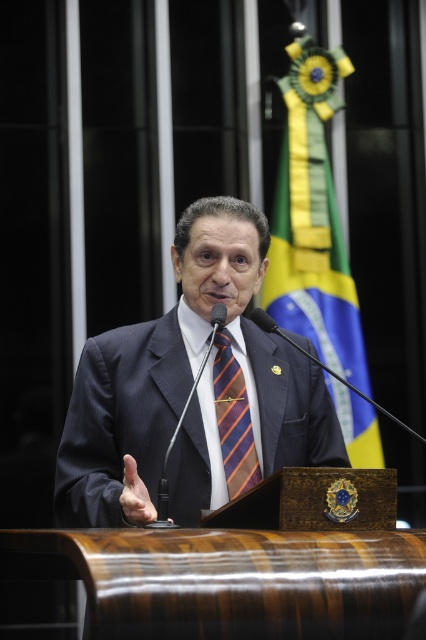
Can you confirm if dark blue suit at center is positioned below yellow-green fabric flag at upper center?

Yes, dark blue suit at center is below yellow-green fabric flag at upper center.

You are a GUI agent. You are given a task and a screenshot of the screen. Output one action in this format:
    pyautogui.click(x=<x>, y=<y>)
    Task: Click on the dark blue suit at center
    The image size is (426, 640).
    Given the screenshot: What is the action you would take?
    pyautogui.click(x=189, y=388)

Image resolution: width=426 pixels, height=640 pixels. In order to click on dark blue suit at center in this screenshot , I will do `click(189, 388)`.

How distant is yellow-green fabric flag at upper center from orange striped tie at center?

A distance of 3.13 meters exists between yellow-green fabric flag at upper center and orange striped tie at center.

Between yellow-green fabric flag at upper center and orange striped tie at center, which one has more height?

With more height is yellow-green fabric flag at upper center.

This screenshot has height=640, width=426. What do you see at coordinates (313, 220) in the screenshot? I see `yellow-green fabric flag at upper center` at bounding box center [313, 220].

Image resolution: width=426 pixels, height=640 pixels. I want to click on yellow-green fabric flag at upper center, so click(x=313, y=220).

Does dark blue suit at center appear under orange striped tie at center?

Actually, dark blue suit at center is above orange striped tie at center.

Who is lower down, dark blue suit at center or orange striped tie at center?

orange striped tie at center

Where is `dark blue suit at center`? dark blue suit at center is located at coordinates (189, 388).

Locate an element on the screen. The image size is (426, 640). dark blue suit at center is located at coordinates (189, 388).